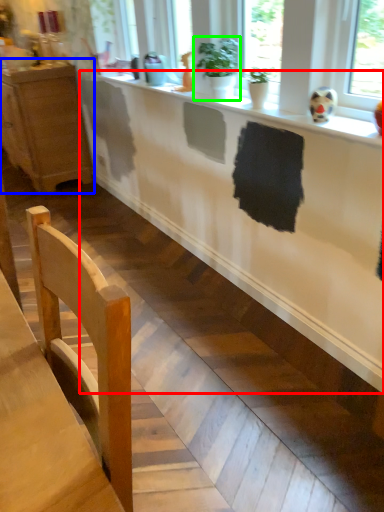
Question: Estimate the real-world distances between objects in this image. Which object is farther from counter (highlighted by a red box), cabinetry (highlighted by a blue box) or houseplant (highlighted by a green box)?

Choices:
 (A) cabinetry
 (B) houseplant

Answer: (A)